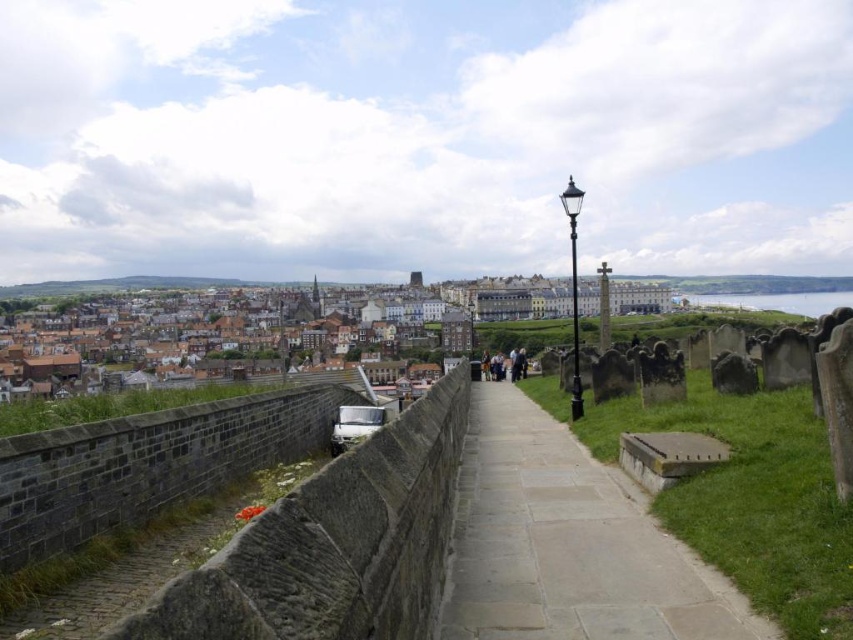
You are a gardener who needs to mow the grass between the gray stone path at center and the dark gray stone tombstones at center. Which area has a narrower width that you need to navigate around?

The gray stone path at center is thinner than the dark gray stone tombstones at center, so the gray stone path at center has a narrower width that you need to navigate around.

You are a tourist exploring the town and want to take a photo of the gray stone path at center and the dark gray stone tombstones at center. Which object should you focus on first if you want to capture both in a single frame without moving your camera?

The gray stone path at center is in front of the dark gray stone tombstones at center, so you should focus on the gray stone path at center first to ensure both are in focus.